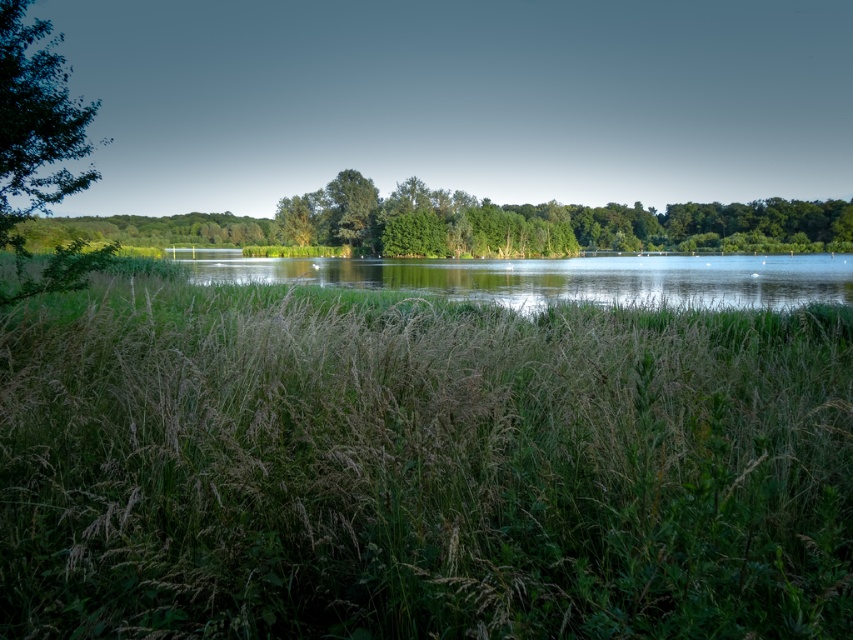
You are a photographer standing at the edge of the water. You want to capture a photo where the green grass at center is visible above the clear water at center. Based on their heights, is this possible?

The green grass at center is not as tall as clear water at center, so the grass is shorter than the water. Since the water is taller, the grass might not be visible above it in the photo unless the camera angle is adjusted to show the grass standing out from the water surface.

You are standing at the edge of the water and see the green grass at center and clear water at center. Which object is closer to your feet?

The green grass at center is closer to your feet because it is positioned below the clear water at center, meaning it is lower in elevation.